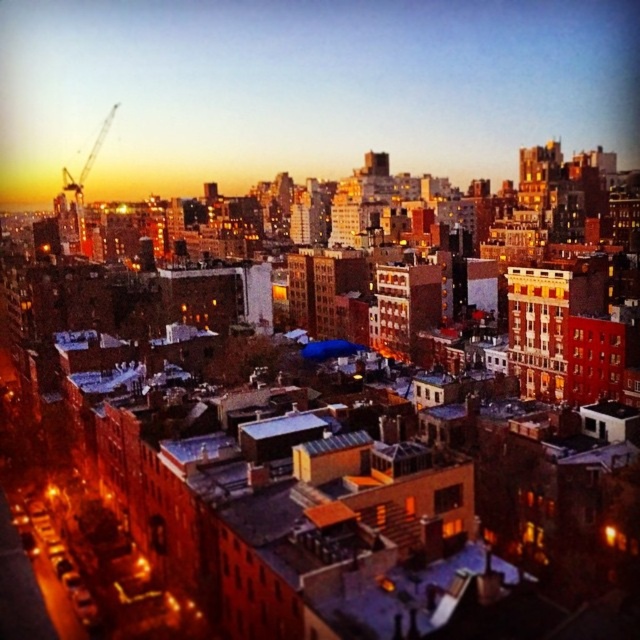
Question: Considering the relative positions of matte concrete buildings at center and metallic construction crane at upper left in the image provided, where is matte concrete buildings at center located with respect to metallic construction crane at upper left?

Choices:
 (A) right
 (B) left

Answer: (A)

Question: Does matte concrete buildings at center appear under metallic construction crane at upper left?

Choices:
 (A) no
 (B) yes

Answer: (A)

Question: Which point is farther to the camera?

Choices:
 (A) matte concrete buildings at center
 (B) metallic construction crane at upper left

Answer: (A)

Question: Can you confirm if matte concrete buildings at center is positioned above metallic construction crane at upper left?

Choices:
 (A) no
 (B) yes

Answer: (B)

Question: Which object is closer to the camera taking this photo?

Choices:
 (A) metallic construction crane at upper left
 (B) matte concrete buildings at center

Answer: (A)